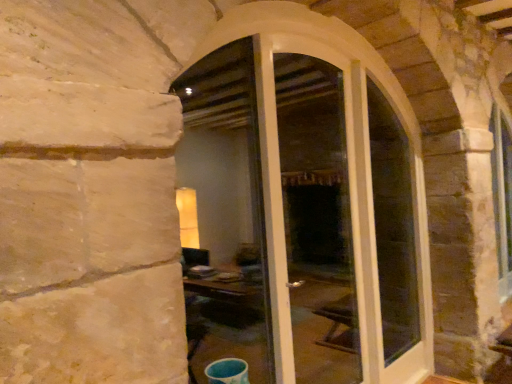
Question: Is white glass door at center in front of or behind white glossy screen door at center in the image?

Choices:
 (A) front
 (B) behind

Answer: (A)

Question: Is point (230, 119) positioned closer to the camera than point (309, 342)?

Choices:
 (A) closer
 (B) farther

Answer: (B)

Question: Which of these objects is positioned farthest from the clear glass door at center?

Choices:
 (A) white glass door at center
 (B) white glossy screen door at center

Answer: (B)

Question: Which object is the closest to the clear glass door at center?

Choices:
 (A) white glass door at center
 (B) white glossy screen door at center

Answer: (A)